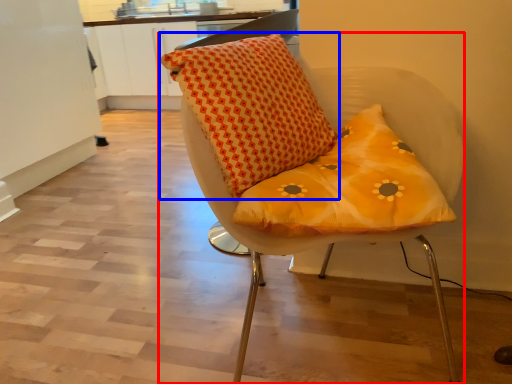
Question: Which point is closer to the camera, chair (highlighted by a red box) or pillow (highlighted by a blue box)?

Choices:
 (A) chair
 (B) pillow

Answer: (A)